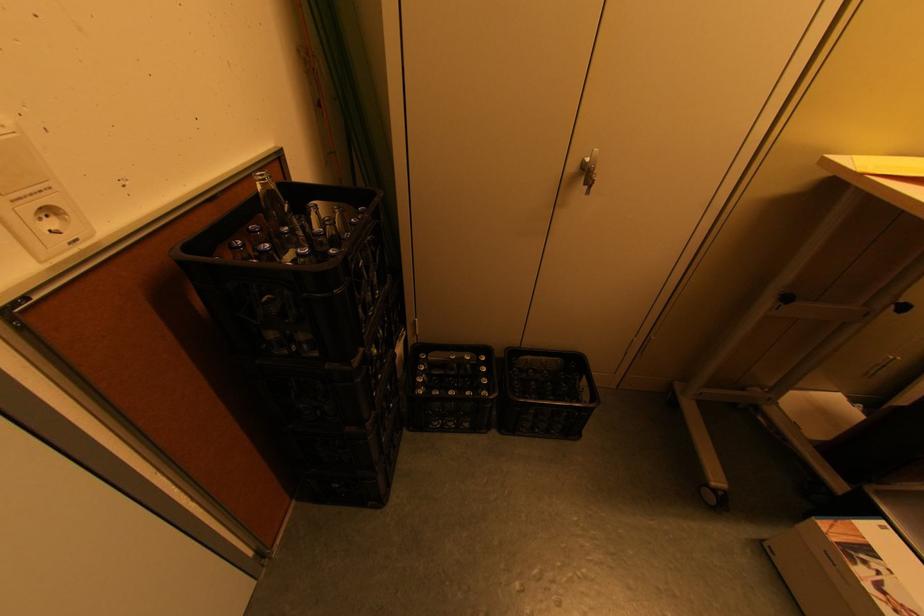
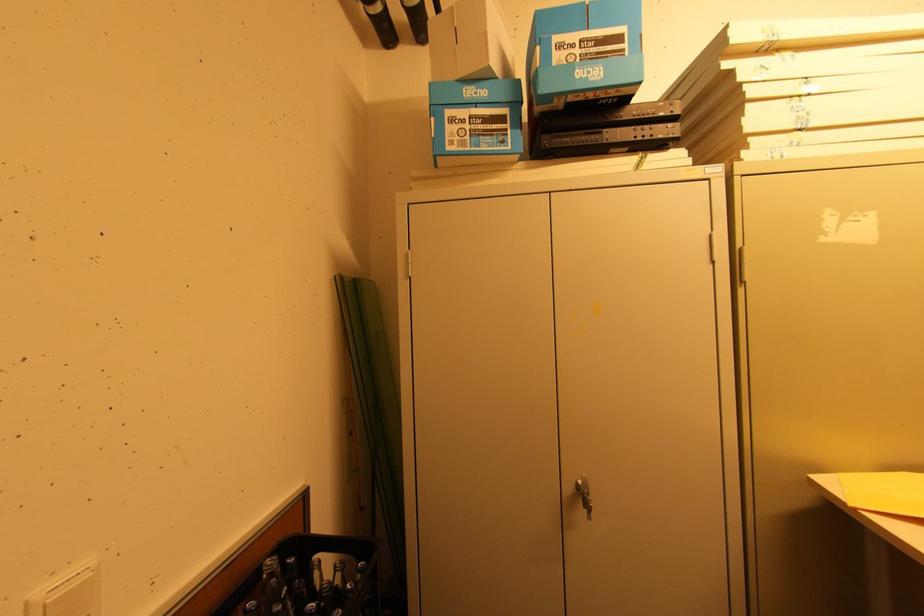
Where in the second image is the point corresponding to point (590, 193) from the first image?

(592, 519)